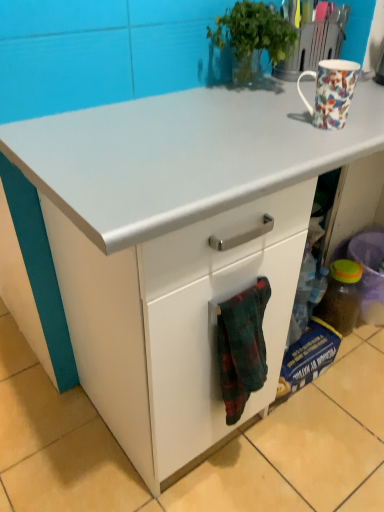
Question: Is flannel fabric towel at lower center positioned before floral porcelain mug at upper right?

Choices:
 (A) yes
 (B) no

Answer: (A)

Question: From the image's perspective, is flannel fabric towel at lower center over floral porcelain mug at upper right?

Choices:
 (A) yes
 (B) no

Answer: (B)

Question: Can you confirm if flannel fabric towel at lower center is wider than floral porcelain mug at upper right?

Choices:
 (A) no
 (B) yes

Answer: (A)

Question: Can you confirm if flannel fabric towel at lower center is bigger than floral porcelain mug at upper right?

Choices:
 (A) yes
 (B) no

Answer: (A)

Question: Considering the relative positions of flannel fabric towel at lower center and floral porcelain mug at upper right in the image provided, is flannel fabric towel at lower center to the left of floral porcelain mug at upper right from the viewer's perspective?

Choices:
 (A) no
 (B) yes

Answer: (B)

Question: From the image's perspective, would you say flannel fabric towel at lower center is shown under floral porcelain mug at upper right?

Choices:
 (A) no
 (B) yes

Answer: (B)

Question: Considering the relative sizes of translucent plastic bottle at lower right and flannel fabric towel at lower center in the image provided, is translucent plastic bottle at lower right thinner than flannel fabric towel at lower center?

Choices:
 (A) no
 (B) yes

Answer: (A)

Question: Does translucent plastic bottle at lower right appear on the left side of flannel fabric towel at lower center?

Choices:
 (A) no
 (B) yes

Answer: (A)

Question: Is flannel fabric towel at lower center located within translucent plastic bottle at lower right?

Choices:
 (A) yes
 (B) no

Answer: (B)

Question: Can you confirm if translucent plastic bottle at lower right is shorter than flannel fabric towel at lower center?

Choices:
 (A) yes
 (B) no

Answer: (A)

Question: Would you consider translucent plastic bottle at lower right to be distant from flannel fabric towel at lower center?

Choices:
 (A) no
 (B) yes

Answer: (A)

Question: Considering the relative positions of translucent plastic bottle at lower right and flannel fabric towel at lower center in the image provided, is translucent plastic bottle at lower right behind flannel fabric towel at lower center?

Choices:
 (A) no
 (B) yes

Answer: (B)

Question: Does floral porcelain mug at upper right have a lesser width compared to translucent plastic bottle at lower right?

Choices:
 (A) yes
 (B) no

Answer: (A)